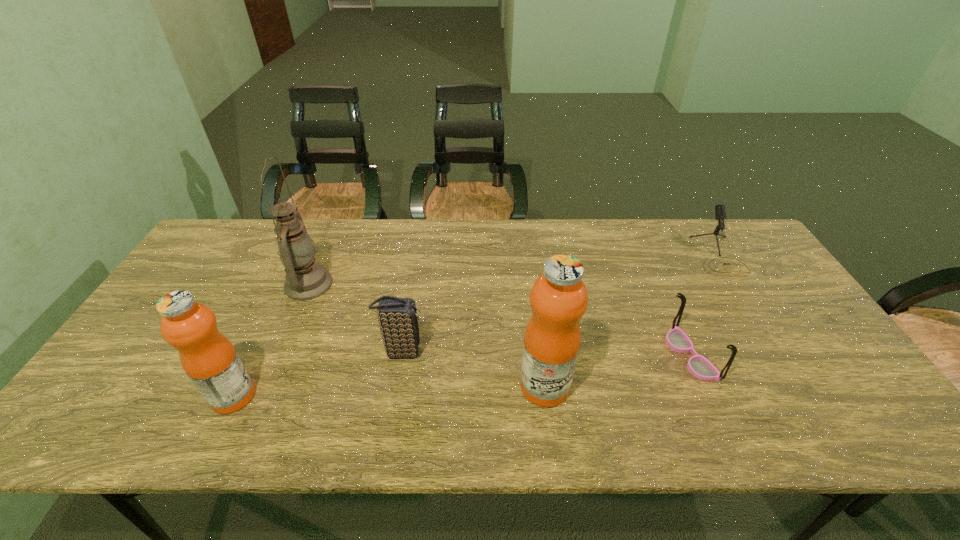
At what (x,y) coordinates should I click in order to perform the action: click on unoccupied area between the third tallest object and the rightmost object. Please return your answer as a coordinate pair (x, y). The height and width of the screenshot is (540, 960). Looking at the image, I should click on (475, 326).

At what (x,y) coordinates should I click in order to perform the action: click on free space between the shorter fruit juice and the fifth object from left to right. Please return your answer as a coordinate pair (x, y). Looking at the image, I should click on (462, 375).

Find the location of a particular element. Image resolution: width=960 pixels, height=540 pixels. object that stands as the second closest to the right fruit juice is located at coordinates (700, 367).

This screenshot has width=960, height=540. What are the coordinates of `the third closest object to the oil lamp` in the screenshot? It's located at (559, 298).

Locate an element on the screen. free space that satisfies the following two spatial constraints: 1. on the back side of the fifth object from left to right; 2. with the zip open on the clutch bag is located at coordinates (688, 352).

The width and height of the screenshot is (960, 540). I want to click on blank area in the image that satisfies the following two spatial constraints: 1. with the zip open on the clutch bag; 2. on the back side of the spectacles, so click(x=401, y=355).